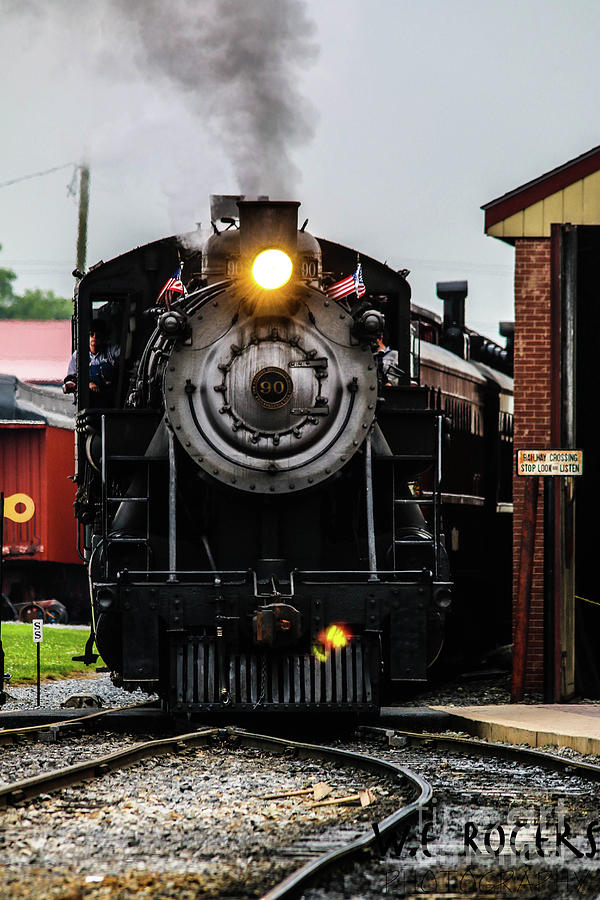
The height and width of the screenshot is (900, 600). I want to click on lights, so click(266, 280).